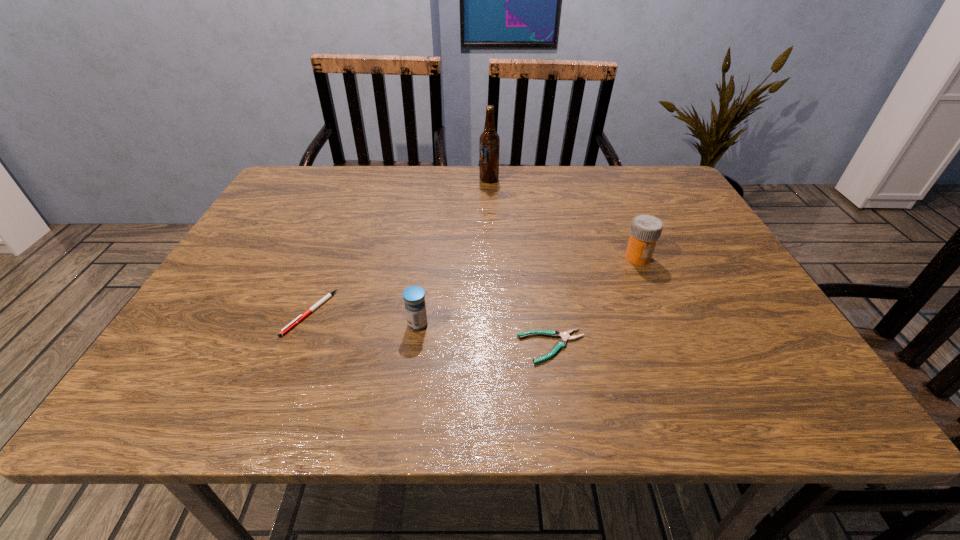
Find the location of a particular element. This screenshot has width=960, height=540. beer bottle is located at coordinates (489, 139).

Locate an element on the screen. The width and height of the screenshot is (960, 540). the farthest object is located at coordinates (489, 139).

Identify the location of the farther medicine. (646, 229).

Locate an element on the screen. This screenshot has height=540, width=960. the right medicine is located at coordinates (646, 229).

The height and width of the screenshot is (540, 960). What are the coordinates of `the second object from left to right` in the screenshot? It's located at (414, 296).

This screenshot has height=540, width=960. I want to click on the third tallest object, so click(x=414, y=296).

The height and width of the screenshot is (540, 960). Identify the location of pen. (x=329, y=295).

Image resolution: width=960 pixels, height=540 pixels. Identify the location of the leftmost object. [329, 295].

This screenshot has width=960, height=540. In order to click on the second object from right to left in this screenshot , I will do `click(565, 336)`.

Where is `pliers`? pliers is located at coordinates 565,336.